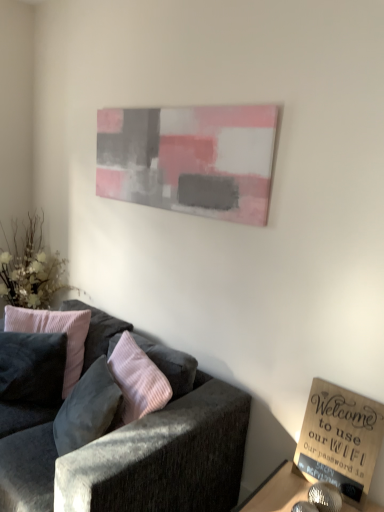
Question: Does painted canvas at upper center have a greater height compared to wooden sign at lower right?

Choices:
 (A) yes
 (B) no

Answer: (A)

Question: Can you confirm if painted canvas at upper center is bigger than wooden sign at lower right?

Choices:
 (A) yes
 (B) no

Answer: (B)

Question: Could wooden sign at lower right be considered to be inside painted canvas at upper center?

Choices:
 (A) yes
 (B) no

Answer: (B)

Question: Considering the relative sizes of painted canvas at upper center and wooden sign at lower right in the image provided, is painted canvas at upper center thinner than wooden sign at lower right?

Choices:
 (A) yes
 (B) no

Answer: (A)

Question: From the image's perspective, is painted canvas at upper center under wooden sign at lower right?

Choices:
 (A) no
 (B) yes

Answer: (A)

Question: Is painted canvas at upper center positioned behind wooden sign at lower right?

Choices:
 (A) no
 (B) yes

Answer: (B)

Question: Is velvet pink pillow at left, which appears as the 2th pillow when viewed from the left, completely or partially outside of painted canvas at upper center?

Choices:
 (A) no
 (B) yes

Answer: (B)

Question: Is velvet pink pillow at left, which appears as the 2th pillow when viewed from the left, looking in the opposite direction of painted canvas at upper center?

Choices:
 (A) yes
 (B) no

Answer: (B)

Question: Does velvet pink pillow at left, which appears as the 2th pillow when viewed from the left, have a larger size compared to painted canvas at upper center?

Choices:
 (A) yes
 (B) no

Answer: (A)

Question: From the image's perspective, is velvet pink pillow at left, which appears as the 2th pillow when viewed from the left, above painted canvas at upper center?

Choices:
 (A) no
 (B) yes

Answer: (A)

Question: From the image's perspective, would you say velvet pink pillow at left, which appears as the 2th pillow when viewed from the left, is shown under painted canvas at upper center?

Choices:
 (A) no
 (B) yes

Answer: (B)

Question: Is velvet pink pillow at left, which appears as the 2th pillow when viewed from the left, with painted canvas at upper center?

Choices:
 (A) yes
 (B) no

Answer: (B)

Question: Is velvet dark gray couch at lower left to the right of wooden sign at lower right from the viewer's perspective?

Choices:
 (A) yes
 (B) no

Answer: (B)